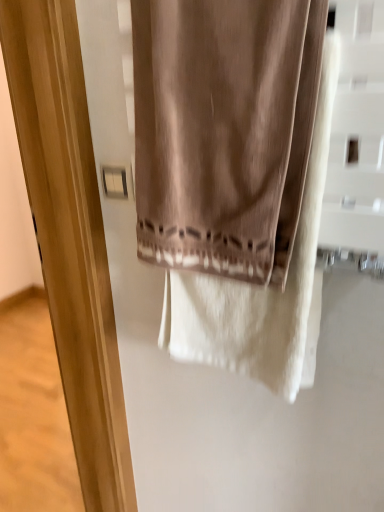
Question: Is point (306, 79) positioned closer to the camera than point (117, 174)?

Choices:
 (A) closer
 (B) farther

Answer: (A)

Question: From the image's perspective, is satin beige curtain at center positioned above or below white plastic light switch at upper left?

Choices:
 (A) below
 (B) above

Answer: (B)

Question: Which is farther from the white plastic light switch at upper left?

Choices:
 (A) matte wood screen door at center
 (B) satin beige curtain at center

Answer: (A)

Question: Which object is the farthest from the satin beige curtain at center?

Choices:
 (A) matte wood screen door at center
 (B) white plastic light switch at upper left

Answer: (A)